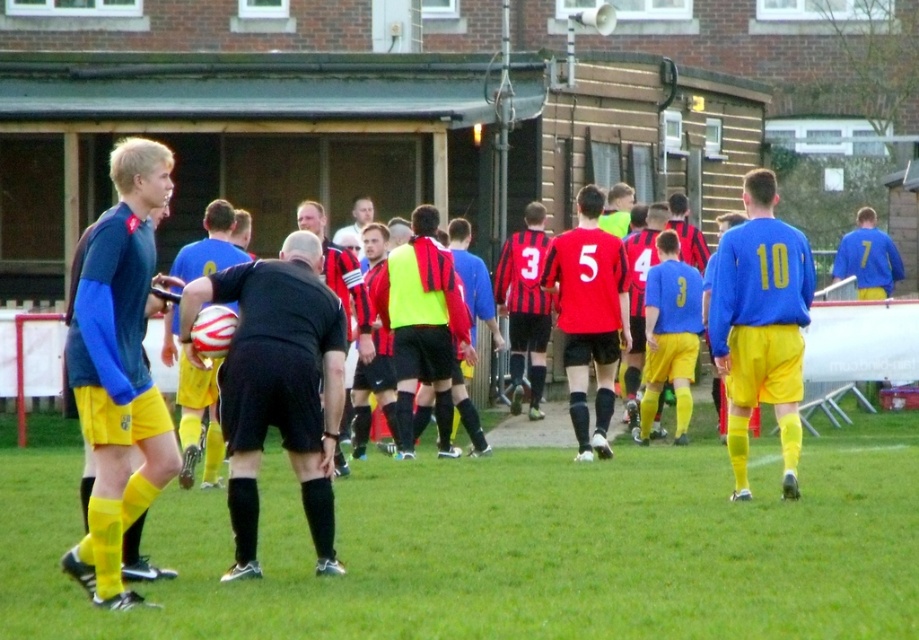
Question: Estimate the real-world distances between objects in this image. Which object is farther from the red matte jersey at center?

Choices:
 (A) matte black soccer ball at center
 (B) blue jersey at right
 (C) red and black striped jersey at center

Answer: (A)

Question: Among these objects, which one is farthest from the camera?

Choices:
 (A) yellow matte shorts at center
 (B) red matte jersey at center
 (C) yellow jersey at center
 (D) neon yellow vest at center

Answer: (C)

Question: Does matte black soccer ball at center have a lesser width compared to black jersey at center?

Choices:
 (A) no
 (B) yes

Answer: (A)

Question: Where is matte black soccer ball at center located in relation to yellow jersey at center in the image?

Choices:
 (A) right
 (B) left

Answer: (B)

Question: Considering the relative positions of black matte referee at center and red matte jersey at center in the image provided, where is black matte referee at center located with respect to red matte jersey at center?

Choices:
 (A) above
 (B) below

Answer: (B)

Question: Which point appears closest to the camera in this image?

Choices:
 (A) (312, 227)
 (B) (338, 416)
 (C) (66, 356)

Answer: (C)